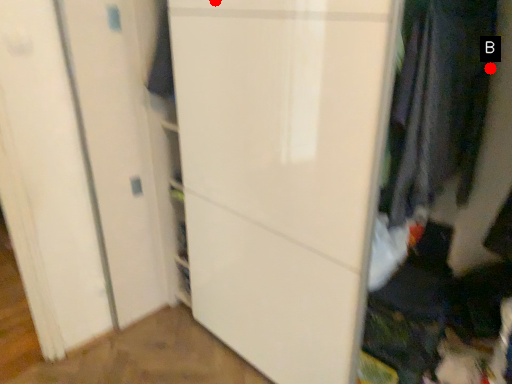
Question: Two points are circled on the image, labeled by A and B beside each circle. Which point is closer to the camera?

Choices:
 (A) A is closer
 (B) B is closer

Answer: (B)